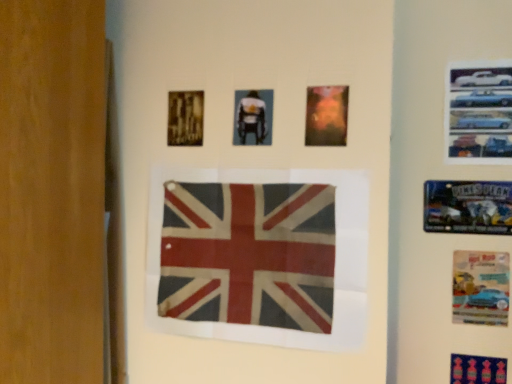
Describe the element at coordinates (253, 116) in the screenshot. I see `matte plastic poster at center, which appears as the 6th poster when viewed from the right` at that location.

Measure the distance between point (x=490, y=316) and camera.

The distance of point (x=490, y=316) from camera is 1.21 meters.

At what (x,y) coordinates should I click in order to perform the action: click on gold textured poster at upper left, which is the first poster from left to right. Please return your answer as a coordinate pair (x, y). The image size is (512, 384). Looking at the image, I should click on (185, 118).

Find the location of a particular element. rusty fabric flag at center is located at coordinates [x=249, y=254].

From the image's perspective, is rusty fabric flag at center positioned above or below matte paper poster at lower right, which appears as the 2th poster when ordered from the bottom?

rusty fabric flag at center is above matte paper poster at lower right, which appears as the 2th poster when ordered from the bottom.

Considering their positions, is rusty fabric flag at center located in front of or behind matte paper poster at lower right, which appears as the 2th poster when ordered from the bottom?

Visually, rusty fabric flag at center is located in front of matte paper poster at lower right, which appears as the 2th poster when ordered from the bottom.

Is rusty fabric flag at center bigger or smaller than matte paper poster at lower right, positioned as the fifth poster in left-to-right order?

Considering their sizes, rusty fabric flag at center takes up more space than matte paper poster at lower right, positioned as the fifth poster in left-to-right order.

Can you see rusty fabric flag at center touching matte paper poster at lower right, the 3th poster viewed from the right?

rusty fabric flag at center and matte paper poster at lower right, the 3th poster viewed from the right, are not in contact.

Considering the positions of objects rusty fabric flag at center and gold textured poster at upper left, which appears as the 6th poster when ordered from the bottom, in the image provided, who is behind, rusty fabric flag at center or gold textured poster at upper left, which appears as the 6th poster when ordered from the bottom,?

Positioned behind is gold textured poster at upper left, which appears as the 6th poster when ordered from the bottom.

From a real-world perspective, is rusty fabric flag at center below gold textured poster at upper left, positioned as the 7th poster in right-to-left order?

Yes, from a real-world perspective, rusty fabric flag at center is beneath gold textured poster at upper left, positioned as the 7th poster in right-to-left order.

Which is correct: rusty fabric flag at center is inside gold textured poster at upper left, which is the first poster from left to right, or outside of it?

The correct answer is: outside.

Is rusty fabric flag at center looking in the opposite direction of gold textured poster at upper left, which is the first poster from left to right?

That's not correct — rusty fabric flag at center is not looking away from gold textured poster at upper left, which is the first poster from left to right.

Is blue fabric poster at lower right, which is counted as the first poster, starting from the bottom, placed right next to matte orange poster at upper center, the fourth poster positioned from the top?

blue fabric poster at lower right, which is counted as the first poster, starting from the bottom, is not next to matte orange poster at upper center, the fourth poster positioned from the top, and they're not touching.

From the image's perspective, count 3rd posters downward from the matte orange poster at upper center, the fourth poster positioned from the top, and point to it. Please provide its 2D coordinates.

[(478, 370)]

Is blue fabric poster at lower right, which appears as the fourth poster when viewed from the left, taller than matte orange poster at upper center, which is counted as the fourth poster, starting from the bottom?

Correct, blue fabric poster at lower right, which appears as the fourth poster when viewed from the left, is much taller as matte orange poster at upper center, which is counted as the fourth poster, starting from the bottom.

From the picture: From a real-world perspective, between blue fabric poster at lower right, positioned as the fourth poster in right-to-left order, and matte orange poster at upper center, which ranks as the third poster in left-to-right order, who is vertically higher?

matte orange poster at upper center, which ranks as the third poster in left-to-right order.

From the picture: Considering the sizes of objects gold textured poster at upper left, positioned as the 7th poster in right-to-left order, and matte orange poster at upper center, the fourth poster positioned from the top, in the image provided, who is shorter, gold textured poster at upper left, positioned as the 7th poster in right-to-left order, or matte orange poster at upper center, the fourth poster positioned from the top,?

With less height is gold textured poster at upper left, positioned as the 7th poster in right-to-left order.

Is gold textured poster at upper left, which appears as the 6th poster when ordered from the bottom, in front of or behind matte orange poster at upper center, arranged as the fifth poster when viewed from the right, in the image?

gold textured poster at upper left, which appears as the 6th poster when ordered from the bottom, is positioned farther from the viewer than matte orange poster at upper center, arranged as the fifth poster when viewed from the right.

Which is closer to the camera, (170, 128) or (319, 139)?

Point (170, 128) appears to be farther away from the viewer than point (319, 139).

Would you say gold textured poster at upper left, positioned as the 7th poster in right-to-left order, is a long distance from matte orange poster at upper center, which is counted as the fourth poster, starting from the bottom?

No, gold textured poster at upper left, positioned as the 7th poster in right-to-left order, is not far away from matte orange poster at upper center, which is counted as the fourth poster, starting from the bottom.

Considering the positions of objects matte orange poster at upper center, arranged as the fifth poster when viewed from the right, and metallic blue poster at upper right, the 3th poster when ordered from bottom to top, in the image provided, who is in front, matte orange poster at upper center, arranged as the fifth poster when viewed from the right, or metallic blue poster at upper right, the 3th poster when ordered from bottom to top,?

Positioned in front is matte orange poster at upper center, arranged as the fifth poster when viewed from the right.

Is matte orange poster at upper center, the fourth poster positioned from the top, not near metallic blue poster at upper right, placed as the fifth poster when sorted from top to bottom?

That's not correct — matte orange poster at upper center, the fourth poster positioned from the top, is a little close to metallic blue poster at upper right, placed as the fifth poster when sorted from top to bottom.

From a real-world perspective, between matte orange poster at upper center, arranged as the fifth poster when viewed from the right, and metallic blue poster at upper right, placed as the fifth poster when sorted from top to bottom, who is vertically lower?

From a 3D spatial view, metallic blue poster at upper right, placed as the fifth poster when sorted from top to bottom, is below.

Measure the distance between matte orange poster at upper center, which is counted as the fourth poster, starting from the bottom, and metallic blue poster at upper right, which appears as the 2th poster when viewed from the right.

They are 44.36 centimeters apart.

From the image's perspective, which object appears higher, metallic cars at upper right, the 7th poster positioned from the left, or blue fabric poster at lower right, which appears as the fourth poster when viewed from the left?

metallic cars at upper right, the 7th poster positioned from the left.

Who is taller, metallic cars at upper right, the 7th poster positioned from the left, or blue fabric poster at lower right, marked as the 7th poster in a top-to-bottom arrangement?

metallic cars at upper right, the 7th poster positioned from the left.

From a real-world perspective, between metallic cars at upper right, marked as the first poster in a right-to-left arrangement, and blue fabric poster at lower right, marked as the 7th poster in a top-to-bottom arrangement, who is vertically lower?

blue fabric poster at lower right, marked as the 7th poster in a top-to-bottom arrangement, is physically lower.

Does point (485, 73) come in front of point (459, 380)?

Yes, it is.

Looking at the image, does metallic cars at upper right, which is counted as the 7th poster, starting from the bottom, seem bigger or smaller compared to matte paper poster at lower right, positioned as the fifth poster in left-to-right order?

In the image, metallic cars at upper right, which is counted as the 7th poster, starting from the bottom, appears to be larger than matte paper poster at lower right, positioned as the fifth poster in left-to-right order.

Between metallic cars at upper right, the first poster when ordered from top to bottom, and matte paper poster at lower right, which appears as the 2th poster when ordered from the bottom, which one has more height?

Standing taller between the two is metallic cars at upper right, the first poster when ordered from top to bottom.

Is metallic cars at upper right, which is counted as the 7th poster, starting from the bottom, far from matte paper poster at lower right, the 3th poster viewed from the right?

No, metallic cars at upper right, which is counted as the 7th poster, starting from the bottom, is in close proximity to matte paper poster at lower right, the 3th poster viewed from the right.

From the picture: What's the angular difference between metallic cars at upper right, which is counted as the 7th poster, starting from the bottom, and matte paper poster at lower right, positioned as the fifth poster in left-to-right order,'s facing directions?

They differ by 0.0964 degrees in their facing directions.

Locate an element on the screen. The width and height of the screenshot is (512, 384). flag on the left of matte paper poster at lower right, the sixth poster viewed from the top is located at coordinates (249, 254).

The width and height of the screenshot is (512, 384). I want to click on flag below the gold textured poster at upper left, which is counted as the 2th poster, starting from the top (from the image's perspective), so click(249, 254).

Looking at the image, which one is located closer to blue fabric poster at lower right, which appears as the fourth poster when viewed from the left, matte paper poster at lower right, the sixth poster viewed from the top, or metallic blue poster at upper right, the sixth poster from the left?

matte paper poster at lower right, the sixth poster viewed from the top.

Estimate the real-world distances between objects in this image. Which object is further from matte paper poster at lower right, positioned as the fifth poster in left-to-right order, matte orange poster at upper center, arranged as the fifth poster when viewed from the right, or rusty fabric flag at center?

Among the two, rusty fabric flag at center is located further to matte paper poster at lower right, positioned as the fifth poster in left-to-right order.

Looking at the image, which one is located closer to blue fabric poster at lower right, positioned as the fourth poster in right-to-left order, rusty fabric flag at center or matte plastic poster at center, marked as the second poster in a left-to-right arrangement?

rusty fabric flag at center is positioned closer to the anchor blue fabric poster at lower right, positioned as the fourth poster in right-to-left order.

Looking at the image, which one is located further to gold textured poster at upper left, which appears as the 6th poster when ordered from the bottom, blue fabric poster at lower right, which appears as the fourth poster when viewed from the left, or metallic cars at upper right, which is counted as the 7th poster, starting from the bottom?

blue fabric poster at lower right, which appears as the fourth poster when viewed from the left.

Based on their spatial positions, is metallic blue poster at upper right, placed as the fifth poster when sorted from top to bottom, or matte orange poster at upper center, which is counted as the fourth poster, starting from the bottom, further from rusty fabric flag at center?

metallic blue poster at upper right, placed as the fifth poster when sorted from top to bottom, is positioned further to the anchor rusty fabric flag at center.

Looking at the image, which one is located further to matte paper poster at lower right, which appears as the 2th poster when ordered from the bottom, blue fabric poster at lower right, which appears as the fourth poster when viewed from the left, or gold textured poster at upper left, positioned as the 7th poster in right-to-left order?

gold textured poster at upper left, positioned as the 7th poster in right-to-left order, lies further to matte paper poster at lower right, which appears as the 2th poster when ordered from the bottom, than the other object.

Which object lies further to the anchor point gold textured poster at upper left, positioned as the 7th poster in right-to-left order, matte plastic poster at center, which appears as the 6th poster when viewed from the right, or blue fabric poster at lower right, marked as the 7th poster in a top-to-bottom arrangement?

The object further to gold textured poster at upper left, positioned as the 7th poster in right-to-left order, is blue fabric poster at lower right, marked as the 7th poster in a top-to-bottom arrangement.

Which object lies nearer to the anchor point rusty fabric flag at center, matte paper poster at lower right, which appears as the 2th poster when ordered from the bottom, or gold textured poster at upper left, which appears as the 6th poster when ordered from the bottom?

Based on the image, gold textured poster at upper left, which appears as the 6th poster when ordered from the bottom, appears to be nearer to rusty fabric flag at center.

This screenshot has height=384, width=512. I want to click on flag that lies between matte plastic poster at center, which appears as the 6th poster when viewed from the right, and blue fabric poster at lower right, which is counted as the first poster, starting from the bottom, from top to bottom, so point(249,254).

This screenshot has width=512, height=384. What are the coordinates of `poster located between gold textured poster at upper left, which appears as the 6th poster when ordered from the bottom, and matte orange poster at upper center, arranged as the fifth poster when viewed from the right, in the left-right direction` in the screenshot? It's located at (253, 116).

At what (x,y) coordinates should I click in order to perform the action: click on flag that lies between metallic cars at upper right, which is counted as the 7th poster, starting from the bottom, and blue fabric poster at lower right, positioned as the fourth poster in right-to-left order, from top to bottom. Please return your answer as a coordinate pair (x, y). The image size is (512, 384). Looking at the image, I should click on (249, 254).

Identify the location of poster between metallic blue poster at upper right, placed as the fifth poster when sorted from top to bottom, and blue fabric poster at lower right, which is counted as the first poster, starting from the bottom, in the up-down direction. This screenshot has width=512, height=384. (481, 287).